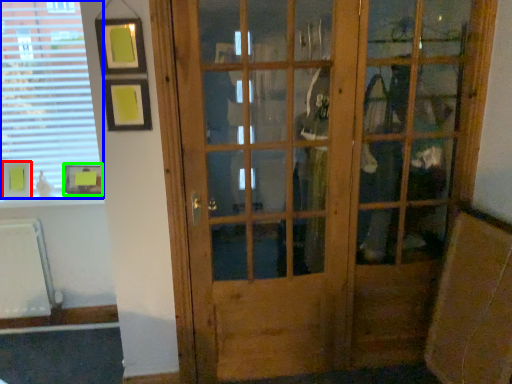
Question: Estimate the real-world distances between objects in this image. Which object is farther from picture frame (highlighted by a red box), window (highlighted by a blue box) or picture frame (highlighted by a green box)?

Choices:
 (A) window
 (B) picture frame

Answer: (A)